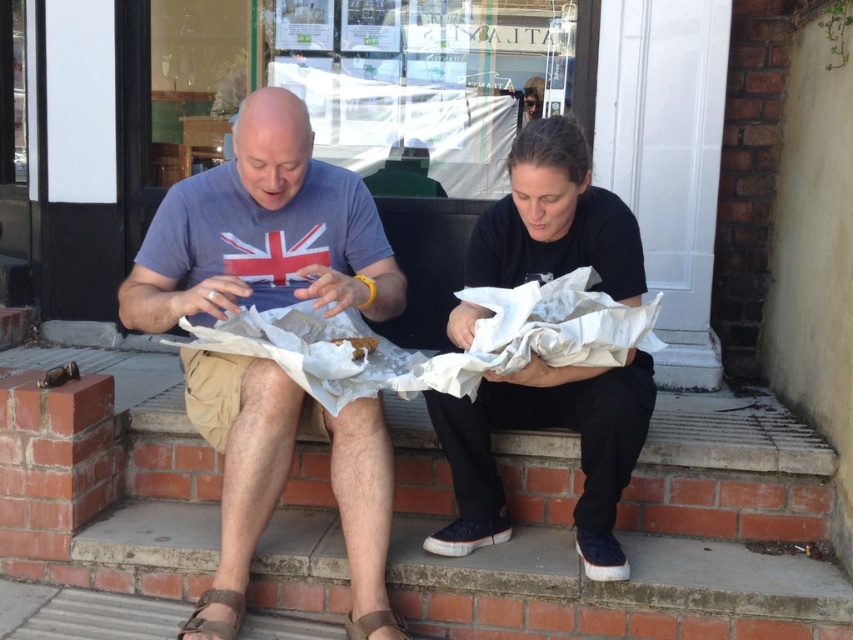
Question: Is matte blue t-shirt at center to the left of brown leather sandal at lower left from the viewer's perspective?

Choices:
 (A) no
 (B) yes

Answer: (A)

Question: Which of the following is the closest to the observer?

Choices:
 (A) brown leather sandal at lower center
 (B) black matte paper bag at center

Answer: (B)

Question: Among these objects, which one is nearest to the camera?

Choices:
 (A) brown leather sandal at lower center
 (B) matte blue t-shirt at center
 (C) black matte paper bag at center
 (D) brown leather sandal at lower left

Answer: (C)

Question: Is matte blue t-shirt at center in front of brown leather sandal at lower center?

Choices:
 (A) yes
 (B) no

Answer: (A)

Question: Can you confirm if matte blue t-shirt at center is smaller than brown leather sandal at lower center?

Choices:
 (A) no
 (B) yes

Answer: (A)

Question: Which is nearer to the black matte paper bag at center?

Choices:
 (A) matte blue t-shirt at center
 (B) brown leather sandal at lower center

Answer: (A)